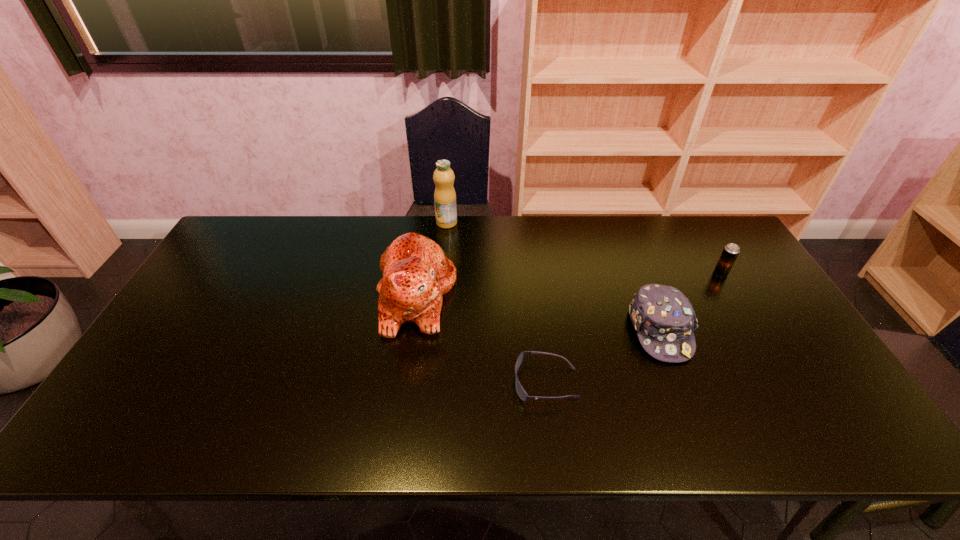
Find the location of a particular element. vacant space located 0.180m on the lenses of the third object from left to right is located at coordinates (441, 383).

Where is `free space located on the lenses of the third object from left to right`? This screenshot has width=960, height=540. free space located on the lenses of the third object from left to right is located at coordinates (356, 383).

At what (x,y) coordinates should I click in order to perform the action: click on vacant space positioned on the lenses of the third object from left to right. Please return your answer as a coordinate pair (x, y). The image size is (960, 540). Looking at the image, I should click on (493, 383).

You are a GUI agent. You are given a task and a screenshot of the screen. Output one action in this format:
    pyautogui.click(x=<x>, y=<y>)
    Task: Click on the fruit juice that is at the far edge
    
    Given the screenshot: What is the action you would take?
    pyautogui.click(x=444, y=196)

Image resolution: width=960 pixels, height=540 pixels. Find the location of `cat present at the far edge`. cat present at the far edge is located at coordinates (416, 273).

What are the coordinates of `object located in the right edge section of the desktop` in the screenshot? It's located at (731, 251).

Image resolution: width=960 pixels, height=540 pixels. I want to click on free spot at the far edge of the desktop, so tap(449, 234).

You are a GUI agent. You are given a task and a screenshot of the screen. Output one action in this format:
    pyautogui.click(x=<x>, y=<y>)
    Task: Click on the vacant space at the near edge of the desktop
    The width and height of the screenshot is (960, 540).
    Given the screenshot: What is the action you would take?
    pyautogui.click(x=330, y=415)

Image resolution: width=960 pixels, height=540 pixels. I want to click on vacant area at the left edge of the desktop, so click(189, 365).

Where is `free region at the right edge`? The width and height of the screenshot is (960, 540). free region at the right edge is located at coordinates (734, 325).